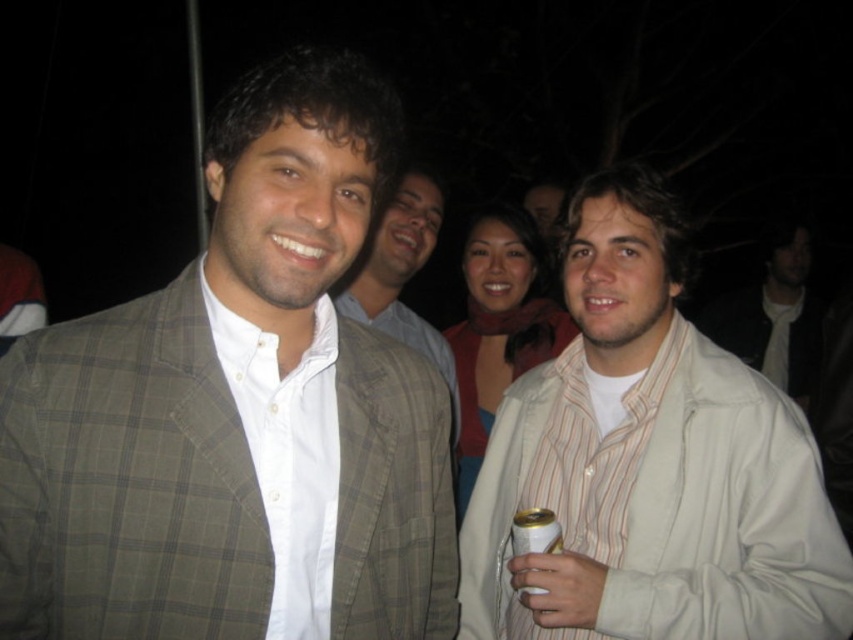
Between white striped shirt at right and matte gray suit at center, which one appears on the right side from the viewer's perspective?

white striped shirt at right

Who is more distant from viewer, (x=846, y=579) or (x=376, y=291)?

The point (x=376, y=291) is behind.

Does point (674, 627) lie in front of point (345, 292)?

Yes, point (674, 627) is in front of point (345, 292).

Locate an element on the screen. white striped shirt at right is located at coordinates (648, 464).

Between white cotton shirt at center and matte gray suit at center, which one has more height?

white cotton shirt at center is taller.

Measure the distance between point (791, 266) and camera.

12.03 feet

Is point (701, 326) in front of point (415, 257)?

That is False.

What are the coordinates of `white cotton shirt at center` in the screenshot? It's located at (773, 316).

Does matte gray suit at center have a smaller size compared to gold metallic can at lower center?

Actually, matte gray suit at center might be larger than gold metallic can at lower center.

Is matte gray suit at center positioned behind gold metallic can at lower center?

Yes, matte gray suit at center is further from the viewer.

Between point (425, 253) and point (544, 520), which one is positioned behind?

The point (425, 253) is more distant.

At what (x,y) coordinates should I click in order to perform the action: click on matte gray suit at center. Please return your answer as a coordinate pair (x, y). Looking at the image, I should click on (402, 275).